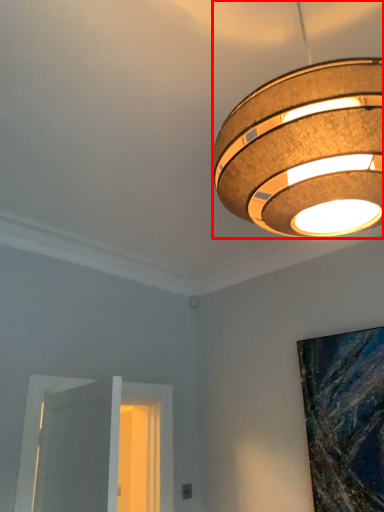
Question: Where is lamp (annotated by the red box) located in relation to window in the image?

Choices:
 (A) left
 (B) right

Answer: (B)